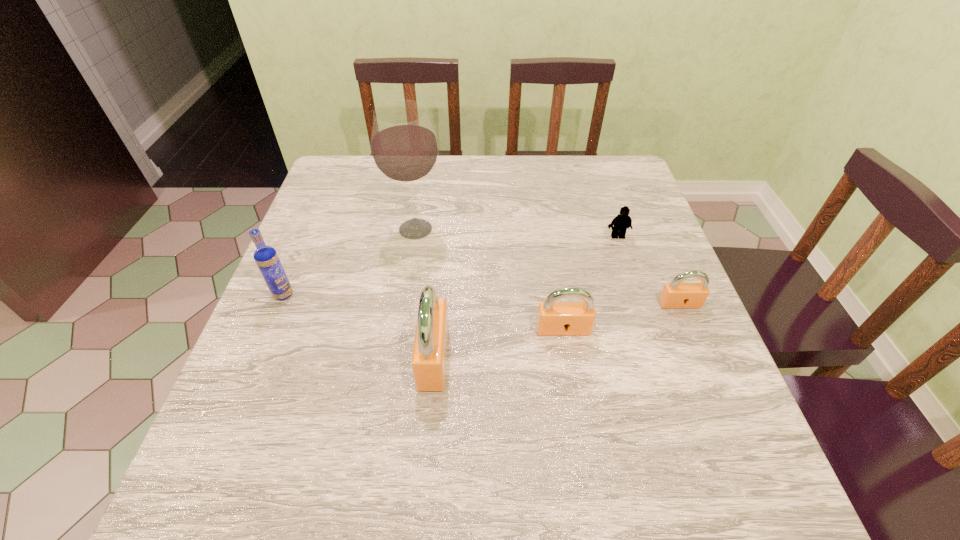
Please point a spot on the left to add another padlock. Please provide its 2D coordinates. Your answer should be formatted as a tuple, i.e. [(x, y)], where the tuple contains the x and y coordinates of a point satisfying the conditions above.

[(289, 389)]